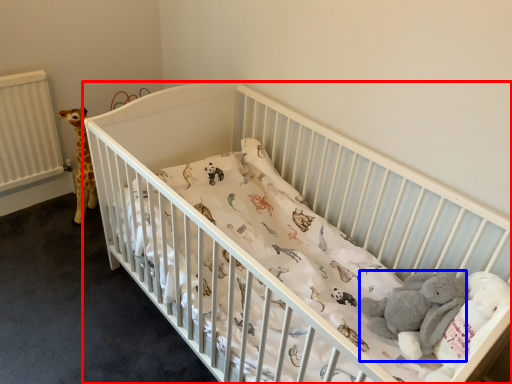
Question: Which of the following is the farthest to the observer, infant bed (highlighted by a red box) or baby elephant (highlighted by a blue box)?

Choices:
 (A) infant bed
 (B) baby elephant

Answer: (B)